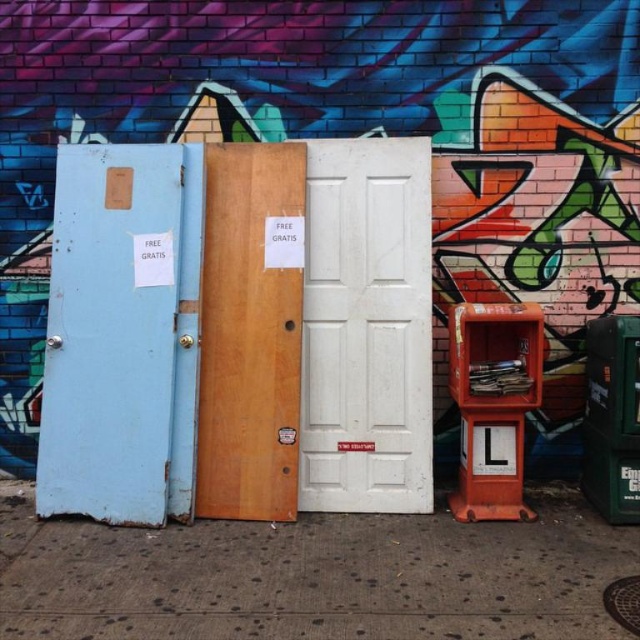
You are a delivery person trying to place a box on the smooth concrete sidewalk at lower center. However, there is a green plastic phone box at right nearby. Which object is shorter so you can place the box on it?

The smooth concrete sidewalk at lower center is not as tall as the green plastic phone box at right, so the smooth concrete sidewalk at lower center is shorter and you can place the box on it.